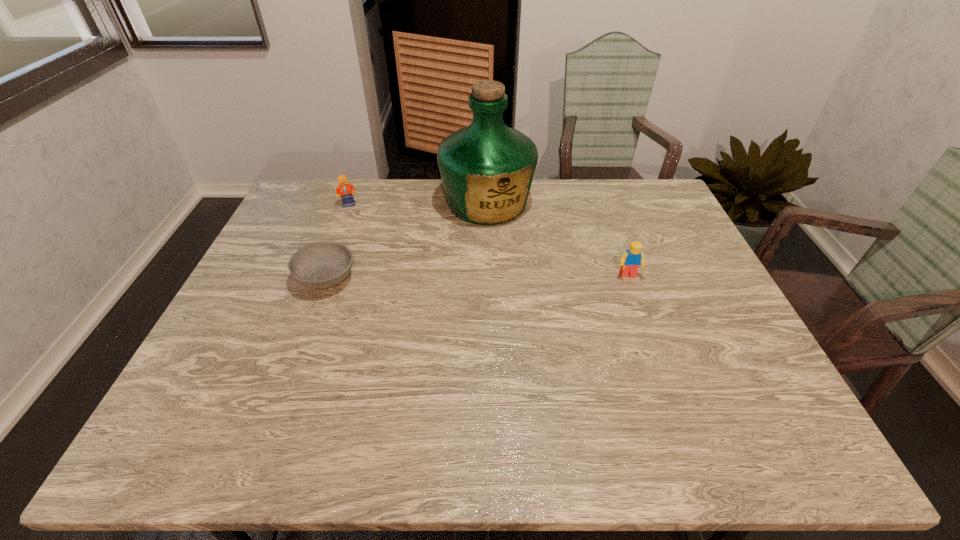
Find the location of `free spot between the tallest object and the right Lego`. free spot between the tallest object and the right Lego is located at coordinates [x=558, y=239].

Where is `empty space that is in between the liquor and the left Lego`? This screenshot has height=540, width=960. empty space that is in between the liquor and the left Lego is located at coordinates (418, 204).

Where is `empty location between the shortest object and the left Lego`? empty location between the shortest object and the left Lego is located at coordinates (337, 241).

In order to click on vacant point located between the left Lego and the shortest object in this screenshot , I will do `click(337, 241)`.

Choose which object is the nearest neighbor to the nearer Lego. Please provide its 2D coordinates. Your answer should be formatted as a tuple, i.e. [(x, y)], where the tuple contains the x and y coordinates of a point satisfying the conditions above.

[(487, 168)]

Locate which object is the second closest to the rightmost object. Please provide its 2D coordinates. Your answer should be formatted as a tuple, i.e. [(x, y)], where the tuple contains the x and y coordinates of a point satisfying the conditions above.

[(320, 265)]

Locate an element on the screen. free point that satisfies the following two spatial constraints: 1. on the back side of the bowl; 2. on the right side of the liquor is located at coordinates (354, 203).

The width and height of the screenshot is (960, 540). What are the coordinates of `free space that satisfies the following two spatial constraints: 1. on the back side of the shortest object; 2. on the left side of the third object from left to right` in the screenshot? It's located at (354, 203).